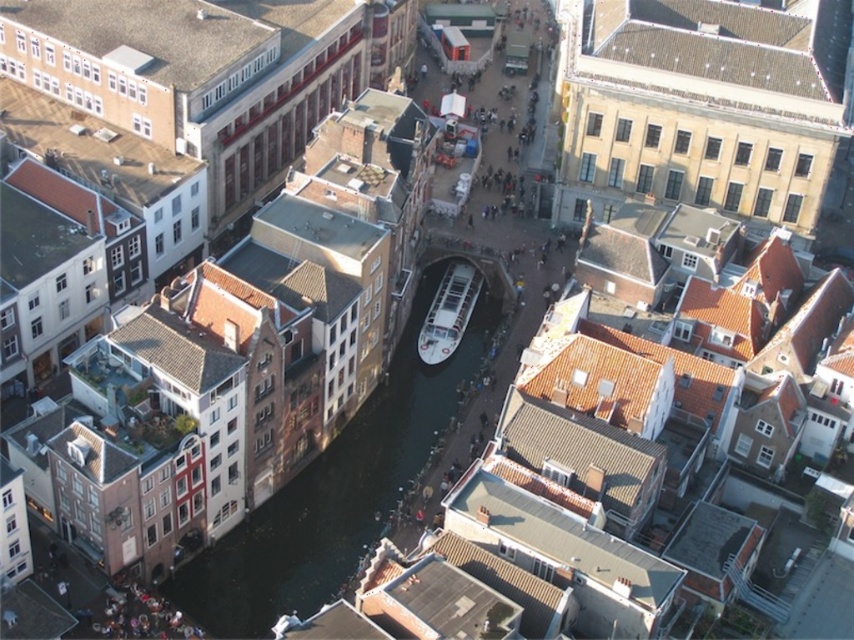
Question: Which point appears closest to the camera in this image?

Choices:
 (A) (433, 396)
 (B) (454, 324)

Answer: (A)

Question: Is black smooth water at center closer to the viewer compared to white glossy boat at center?

Choices:
 (A) no
 (B) yes

Answer: (B)

Question: Among these points, which one is nearest to the camera?

Choices:
 (A) (335, 547)
 (B) (472, 284)

Answer: (A)

Question: Is black smooth water at center above white glossy boat at center?

Choices:
 (A) no
 (B) yes

Answer: (A)

Question: Does black smooth water at center come in front of white glossy boat at center?

Choices:
 (A) no
 (B) yes

Answer: (B)